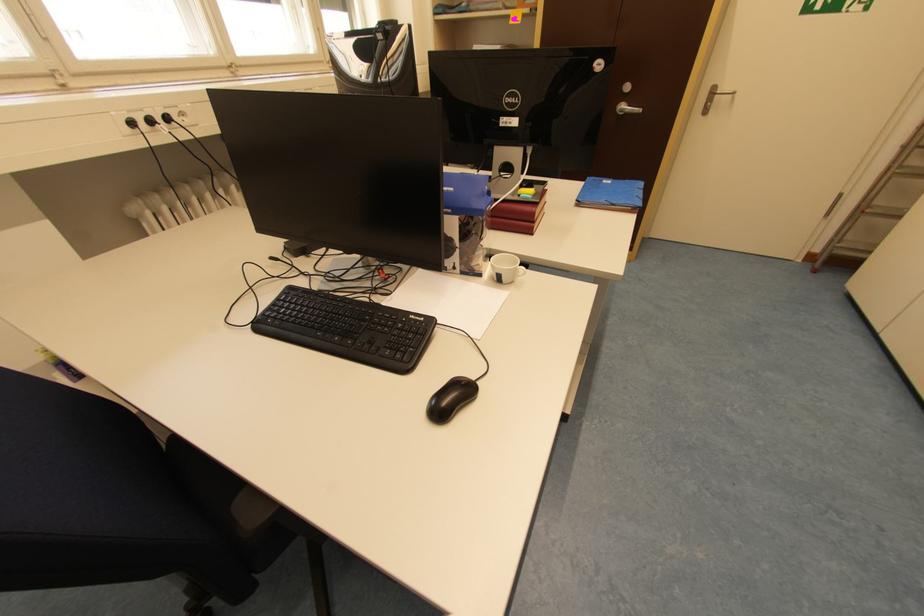
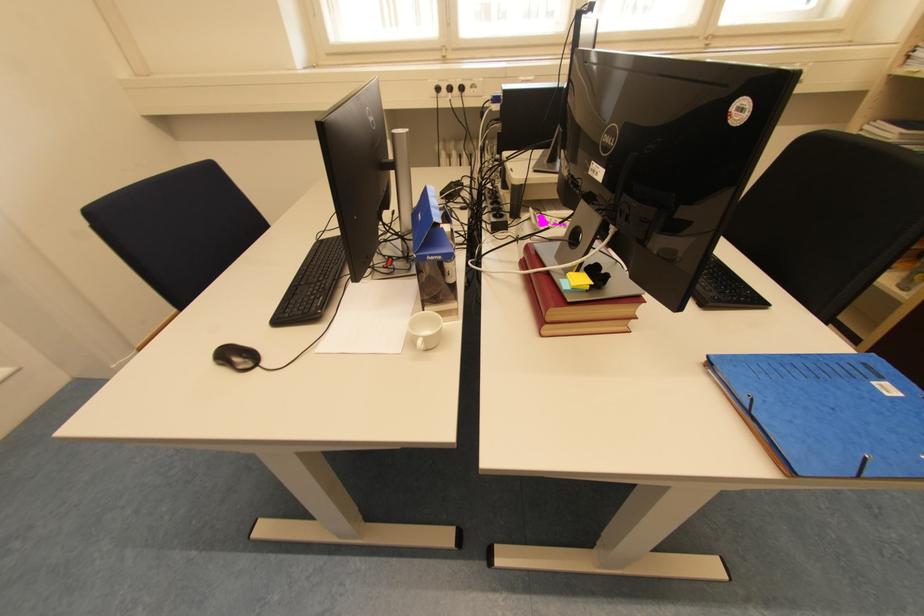
Where in the second image is the point corresponding to (609,182) from the first image?

(888, 379)